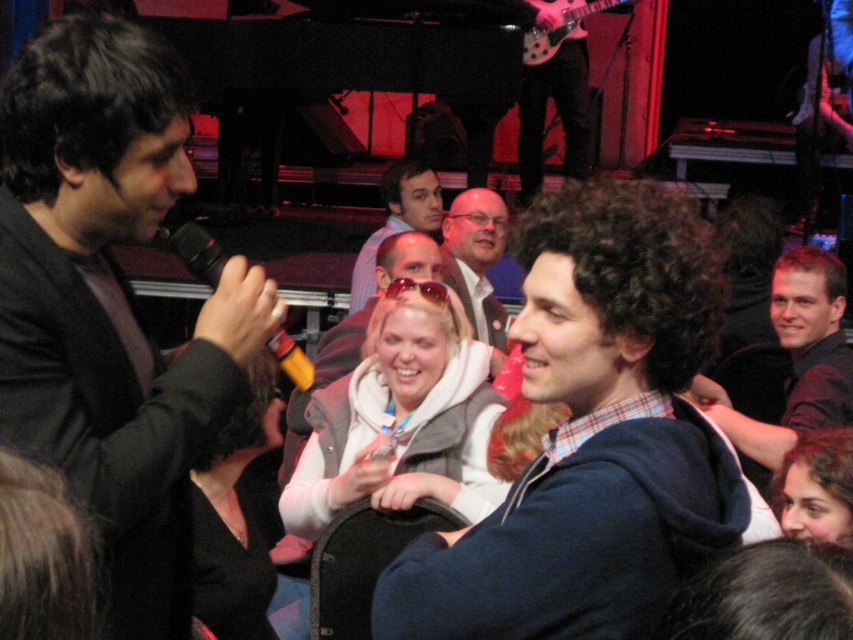
Question: Is blue fleece jacket at center wider than dark brown hair at right?

Choices:
 (A) no
 (B) yes

Answer: (A)

Question: Which of the following is the farthest from the observer?

Choices:
 (A) black matte jacket at left
 (B) matte black glasses at center
 (C) orange matte microphone at left

Answer: (B)

Question: Is light brown hair at center wider than orange matte microphone at left?

Choices:
 (A) no
 (B) yes

Answer: (B)

Question: Which object appears farthest from the camera in this image?

Choices:
 (A) orange matte microphone at left
 (B) light brown hair at center
 (C) smooth brown hair at lower right

Answer: (B)

Question: Which of the following is the farthest from the observer?

Choices:
 (A) matte black glasses at center
 (B) white fleece vest at center
 (C) black fabric jacket at center
 (D) black matte jacket at left

Answer: (A)

Question: Does smooth brown hair at lower right appear over matte black glasses at center?

Choices:
 (A) yes
 (B) no

Answer: (B)